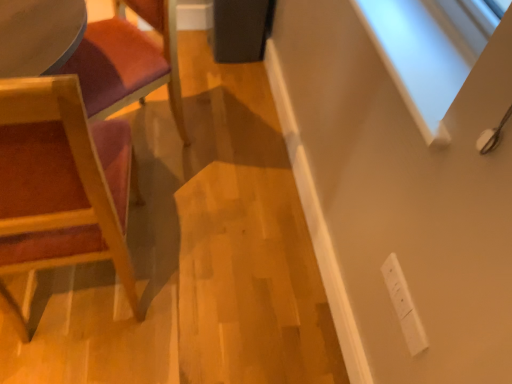
Question: From a real-world perspective, is wooden chair at left, arranged as the 1th chair when ordered from the bottom, above or below wooden chair at left, marked as the 1th chair in a top-to-bottom arrangement?

Choices:
 (A) above
 (B) below

Answer: (A)

Question: Looking at their shapes, would you say wooden chair at left, which is counted as the second chair, starting from the top, is wider or thinner than wooden chair at left, marked as the 1th chair in a top-to-bottom arrangement?

Choices:
 (A) thin
 (B) wide

Answer: (A)

Question: Based on their relative distances, which object is nearer to the white plastic electric outlet at lower right?

Choices:
 (A) wooden chair at left, arranged as the 1th chair when ordered from the bottom
 (B) wooden chair at left, the 2th chair ordered from the bottom

Answer: (A)

Question: Which is nearer to the wooden chair at left, which is counted as the second chair, starting from the top?

Choices:
 (A) white plastic electric outlet at lower right
 (B) wooden chair at left, the 2th chair ordered from the bottom

Answer: (B)